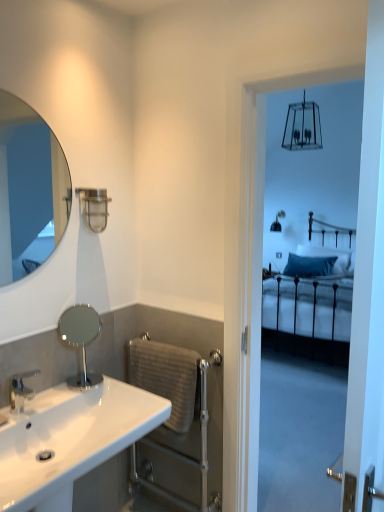
Question: Is the depth of gray textured towel bar at lower center less than that of white glossy sink at lower left?

Choices:
 (A) yes
 (B) no

Answer: (B)

Question: From the image's perspective, is gray textured towel bar at lower center on top of white glossy sink at lower left?

Choices:
 (A) yes
 (B) no

Answer: (A)

Question: Can you confirm if gray textured towel bar at lower center is thinner than white glossy sink at lower left?

Choices:
 (A) yes
 (B) no

Answer: (A)

Question: Is gray textured towel bar at lower center positioned with its back to white glossy sink at lower left?

Choices:
 (A) yes
 (B) no

Answer: (B)

Question: Is gray textured towel bar at lower center surrounding white glossy sink at lower left?

Choices:
 (A) no
 (B) yes

Answer: (A)

Question: In terms of width, does polished chrome mirror at center, which ranks as the 2th mirror in top-to-bottom order, look wider or thinner when compared to blue velvet pillow at center?

Choices:
 (A) thin
 (B) wide

Answer: (A)

Question: Would you say polished chrome mirror at center, which appears as the first mirror when ordered from the bottom, is to the left or to the right of blue velvet pillow at center in the picture?

Choices:
 (A) right
 (B) left

Answer: (B)

Question: Is point click(x=62, y=317) closer or farther from the camera than point click(x=327, y=266)?

Choices:
 (A) closer
 (B) farther

Answer: (A)

Question: From the image's perspective, is polished chrome mirror at center, which appears as the first mirror when ordered from the bottom, located above or below blue velvet pillow at center?

Choices:
 (A) below
 (B) above

Answer: (A)

Question: In terms of size, does polished chrome mirror at center, which ranks as the 2th mirror in top-to-bottom order, appear bigger or smaller than silver metallic towel rail at lower center?

Choices:
 (A) small
 (B) big

Answer: (A)

Question: Is polished chrome mirror at center, which appears as the first mirror when ordered from the bottom, wider or thinner than silver metallic towel rail at lower center?

Choices:
 (A) wide
 (B) thin

Answer: (B)

Question: From a real-world perspective, is polished chrome mirror at center, which appears as the first mirror when ordered from the bottom, above or below silver metallic towel rail at lower center?

Choices:
 (A) below
 (B) above

Answer: (B)

Question: Visually, is polished chrome mirror at center, which ranks as the 2th mirror in top-to-bottom order, positioned to the left or to the right of silver metallic towel rail at lower center?

Choices:
 (A) right
 (B) left

Answer: (B)

Question: From the image's perspective, is white glossy sink at lower left above or below matte silver mirror at upper left, marked as the 1th mirror in a top-to-bottom arrangement?

Choices:
 (A) above
 (B) below

Answer: (B)

Question: From a real-world perspective, relative to matte silver mirror at upper left, marked as the 1th mirror in a top-to-bottom arrangement, is white glossy sink at lower left vertically above or below?

Choices:
 (A) above
 (B) below

Answer: (B)